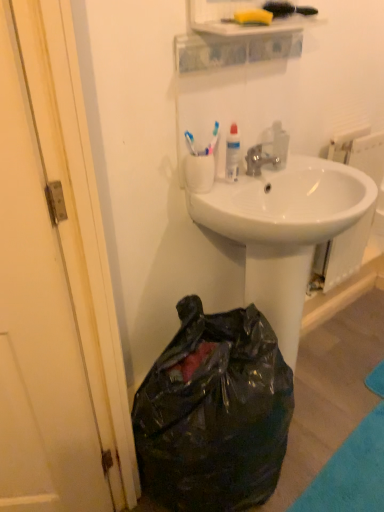
What do you see at coordinates (284, 230) in the screenshot? The height and width of the screenshot is (512, 384). I see `white glossy sink at center` at bounding box center [284, 230].

Identify the location of white glossy radiator at upper right. Image resolution: width=384 pixels, height=512 pixels. click(x=343, y=253).

Find the location of a particular element. silver metallic faucet at center is located at coordinates (259, 160).

Where is `black plastic bag at lower left`? black plastic bag at lower left is located at coordinates (214, 413).

Is white glossy sink at center not near silver metallic faucet at center?

white glossy sink at center is near silver metallic faucet at center, not far away.

Is white glossy sink at center smaller than silver metallic faucet at center?

Actually, white glossy sink at center might be larger than silver metallic faucet at center.

Could you tell me if white glossy sink at center is facing silver metallic faucet at center?

No, white glossy sink at center does not turn towards silver metallic faucet at center.

From a real-world perspective, is white glossy sink at center located higher than silver metallic faucet at center?

No, from a real-world perspective, white glossy sink at center is not over silver metallic faucet at center

At what (x,y) coordinates should I click in order to perform the action: click on radiator above the black plastic bag at lower left (from the image's perspective). Please return your answer as a coordinate pair (x, y). This screenshot has width=384, height=512. Looking at the image, I should click on (343, 253).

How different are the orientations of black plastic bag at lower left and white glossy radiator at upper right in degrees?

There is a 0.901-degree angle between the facing directions of black plastic bag at lower left and white glossy radiator at upper right.

In the scene shown: From their relative heights in the image, would you say black plastic bag at lower left is taller or shorter than white glossy radiator at upper right?

Clearly, black plastic bag at lower left is shorter compared to white glossy radiator at upper right.

Does black plastic bag at lower left have a smaller size compared to white glossy radiator at upper right?

Actually, black plastic bag at lower left might be larger than white glossy radiator at upper right.

Looking at this image, between white plastic cup at upper center and silver metallic faucet at center, which one appears on the left side from the viewer's perspective?

white plastic cup at upper center.

Which object is wider, white plastic cup at upper center or silver metallic faucet at center?

silver metallic faucet at center is wider.

Considering their positions, is white plastic cup at upper center located in front of or behind silver metallic faucet at center?

white plastic cup at upper center is in front of silver metallic faucet at center.

Is white plastic cup at upper center situated inside silver metallic faucet at center or outside?

white plastic cup at upper center cannot be found inside silver metallic faucet at center.

Which object is closer to the camera taking this photo, silver metallic faucet at center or white glossy sink at center?

white glossy sink at center is in front.

Considering the sizes of objects silver metallic faucet at center and white glossy sink at center in the image provided, who is bigger, silver metallic faucet at center or white glossy sink at center?

white glossy sink at center is bigger.

Considering the relative positions of silver metallic faucet at center and white glossy sink at center in the image provided, is silver metallic faucet at center to the right of white glossy sink at center from the viewer's perspective?

In fact, silver metallic faucet at center is to the left of white glossy sink at center.

From a real-world perspective, is white glossy sink at center positioned over white plastic cup at upper center based on gravity?

Incorrect, from a real-world perspective, white glossy sink at center is lower than white plastic cup at upper center.

Is white glossy sink at center at the right side of white plastic cup at upper center?

Yes, white glossy sink at center is to the right of white plastic cup at upper center.

Is point (279, 194) in front of point (190, 190)?

That is False.

Is the surface of white glossy sink at center in direct contact with white plastic cup at upper center?

white glossy sink at center and white plastic cup at upper center are not in contact.

How many degrees apart are the facing directions of silver metallic faucet at center and white plastic cup at upper center?

The facing directions of silver metallic faucet at center and white plastic cup at upper center are 0.00158 degrees apart.

Looking at this image, from a real-world perspective, is silver metallic faucet at center located beneath white plastic cup at upper center?

Yes.

Which is more to the left, silver metallic faucet at center or white plastic cup at upper center?

Positioned to the left is white plastic cup at upper center.

Is black plastic bag at lower left not within silver metallic faucet at center?

That's correct, black plastic bag at lower left is outside of silver metallic faucet at center.

The image size is (384, 512). What are the coordinates of `faucet that is above the black plastic bag at lower left (from a real-world perspective)` in the screenshot? It's located at (259, 160).

Is point (237, 357) closer to viewer compared to point (268, 155)?

That is True.

From a real-world perspective, between black plastic bag at lower left and silver metallic faucet at center, who is vertically higher?

In real-world perspective, silver metallic faucet at center is above.

This screenshot has width=384, height=512. What are the coordinates of `faucet on the left of white glossy sink at center` in the screenshot? It's located at (259, 160).

Identify the location of radiator that is above the black plastic bag at lower left (from a real-world perspective). The image size is (384, 512). (343, 253).

Which object lies further to the anchor point silver metallic faucet at center, white glossy sink at center or black plastic bag at lower left?

black plastic bag at lower left is further to silver metallic faucet at center.

Based on their spatial positions, is white glossy radiator at upper right or silver metallic faucet at center closer to white plastic cup at upper center?

silver metallic faucet at center lies closer to white plastic cup at upper center than the other object.

Looking at the image, which one is located closer to white glossy radiator at upper right, silver metallic faucet at center or white glossy sink at center?

white glossy sink at center is positioned closer to the anchor white glossy radiator at upper right.

Looking at the image, which one is located further to white glossy radiator at upper right, white glossy sink at center or white plastic cup at upper center?

The object further to white glossy radiator at upper right is white plastic cup at upper center.

Which object lies further to the anchor point white plastic cup at upper center, white glossy sink at center or silver metallic faucet at center?

white glossy sink at center lies further to white plastic cup at upper center than the other object.

Looking at the image, which one is located closer to white glossy sink at center, black plastic bag at lower left or silver metallic faucet at center?

Based on the image, silver metallic faucet at center appears to be nearer to white glossy sink at center.

Based on the photo, which object lies nearer to the anchor point white glossy radiator at upper right, white glossy sink at center or silver metallic faucet at center?

white glossy sink at center is positioned closer to the anchor white glossy radiator at upper right.

Which object lies further to the anchor point black plastic bag at lower left, white plastic cup at upper center or white glossy radiator at upper right?

Among the two, white glossy radiator at upper right is located further to black plastic bag at lower left.

This screenshot has height=512, width=384. I want to click on radiator that lies between white plastic cup at upper center and black plastic bag at lower left from top to bottom, so click(343, 253).

This screenshot has width=384, height=512. What are the coordinates of `faucet positioned between white glossy sink at center and white glossy radiator at upper right from near to far` in the screenshot? It's located at (259, 160).

At what (x,y) coordinates should I click in order to perform the action: click on coffee cup that lies between silver metallic faucet at center and white glossy sink at center from top to bottom. Please return your answer as a coordinate pair (x, y). This screenshot has width=384, height=512. Looking at the image, I should click on (199, 173).

The width and height of the screenshot is (384, 512). I want to click on coffee cup between silver metallic faucet at center and black plastic bag at lower left in the up-down direction, so click(x=199, y=173).